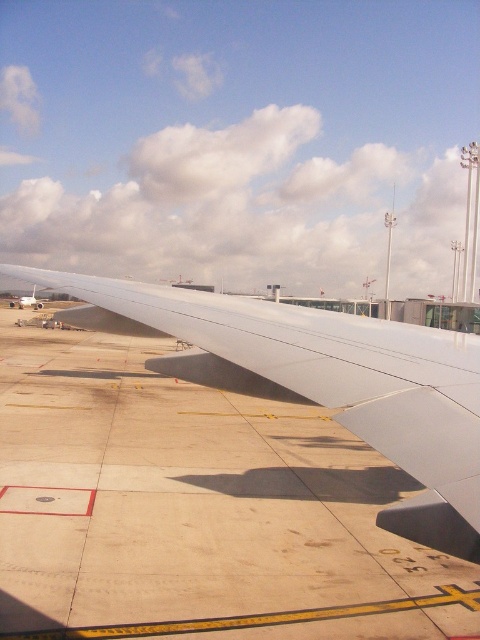
Is point (457, 404) more distant than point (35, 304)?

No, (457, 404) is in front of (35, 304).

This screenshot has height=640, width=480. What do you see at coordinates (324, 381) in the screenshot?
I see `white matte wing at center` at bounding box center [324, 381].

The height and width of the screenshot is (640, 480). I want to click on white matte wing at center, so click(324, 381).